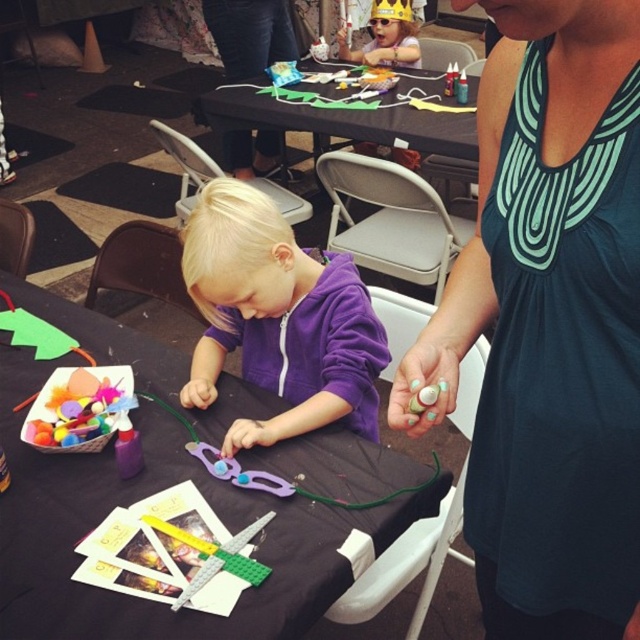
Question: Is matte purple hoodie at center thinner than purple plastic scissors at center?

Choices:
 (A) no
 (B) yes

Answer: (A)

Question: Which point is closer to the camera?

Choices:
 (A) teal fabric tank top at upper right
 (B) purple plastic scissors at center
 (C) matte purple hoodie at center

Answer: (A)

Question: Which of the following is the farthest from the observer?

Choices:
 (A) (257, 472)
 (B) (234, 209)

Answer: (B)

Question: Is teal fabric tank top at upper right smaller than black fabric table at center?

Choices:
 (A) yes
 (B) no

Answer: (A)

Question: Among these objects, which one is farthest from the camera?

Choices:
 (A) matte purple hoodie at center
 (B) black fabric table at center
 (C) teal fabric tank top at upper right
 (D) purple fleece hoodie at center

Answer: (A)

Question: Does black fabric table at center appear on the right side of purple fleece hoodie at center?

Choices:
 (A) yes
 (B) no

Answer: (B)